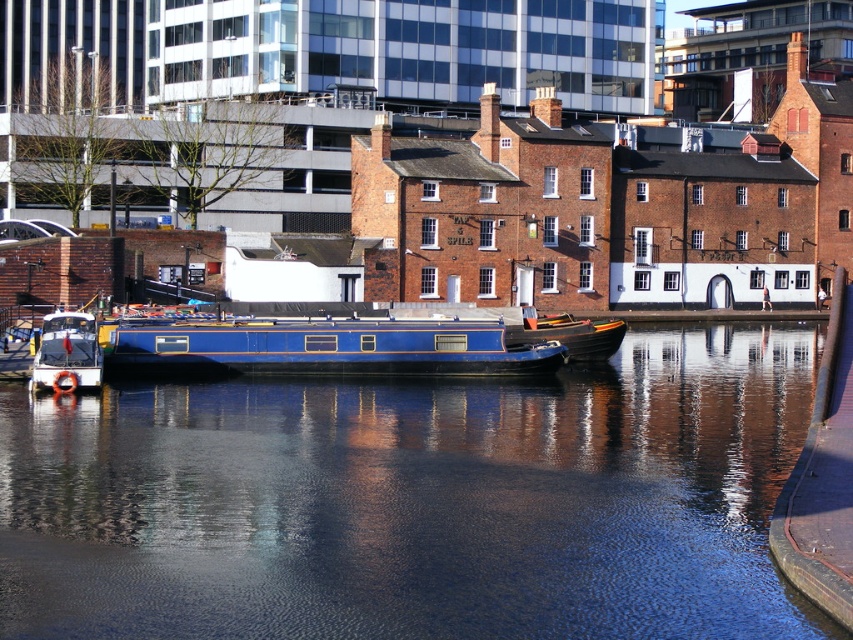
Question: Estimate the real-world distances between objects in this image. Which object is closer to the blue polished wood barge at center?

Choices:
 (A) wooden boat at center
 (B) white glossy boat at left
 (C) blue water at center

Answer: (B)

Question: Considering the real-world distances, which object is farthest from the blue polished wood barge at center?

Choices:
 (A) blue water at center
 (B) white glossy boat at left

Answer: (A)

Question: Which point is farther to the camera?

Choices:
 (A) (573, 352)
 (B) (619, 593)
 (C) (495, 364)
 (D) (48, 385)

Answer: (A)

Question: Does blue polished wood barge at center come in front of wooden boat at center?

Choices:
 (A) no
 (B) yes

Answer: (B)

Question: Does white glossy boat at left lie in front of wooden boat at center?

Choices:
 (A) yes
 (B) no

Answer: (A)

Question: Observing the image, what is the correct spatial positioning of blue water at center in reference to wooden boat at center?

Choices:
 (A) below
 (B) above

Answer: (A)